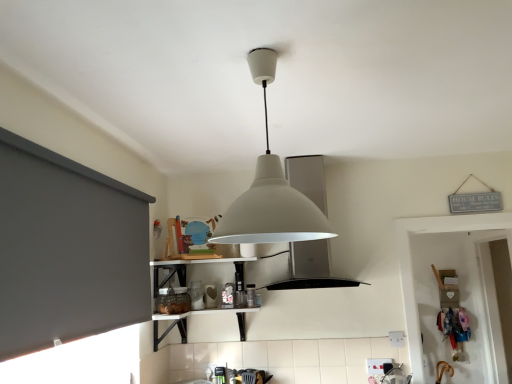
Where is `white matte vent at center`? The height and width of the screenshot is (384, 512). white matte vent at center is located at coordinates (311, 268).

Is white matte vent at center in contact with dark gray matte window screen at left?

No, white matte vent at center is not beside dark gray matte window screen at left.

Who is taller, white matte vent at center or dark gray matte window screen at left?

Standing taller between the two is white matte vent at center.

From the image's perspective, which is below, white matte vent at center or dark gray matte window screen at left?

dark gray matte window screen at left appears lower in the image.

What's the angular difference between white matte vent at center and dark gray matte window screen at left's facing directions?

The facing directions of white matte vent at center and dark gray matte window screen at left are 90.5 degrees apart.

Is dark gray matte window screen at left positioned with its back to white matte vent at center?

dark gray matte window screen at left does not have its back to white matte vent at center.

Based on their sizes in the image, would you say dark gray matte window screen at left is bigger or smaller than white matte vent at center?

dark gray matte window screen at left is smaller than white matte vent at center.

Considering the positions of points (102, 184) and (278, 287), is point (102, 184) closer to camera compared to point (278, 287)?

Yes, it is.

Are dark gray matte window screen at left and white matte vent at center far apart?

dark gray matte window screen at left is far away from white matte vent at center.

From a real-world perspective, is white matte lampshade at center located beneath white matte vent at center?

No.

Considering the sizes of objects white matte lampshade at center and white matte vent at center in the image provided, who is smaller, white matte lampshade at center or white matte vent at center?

white matte lampshade at center is smaller.

Which is more to the left, white matte lampshade at center or white matte vent at center?

white matte lampshade at center is more to the left.

Does white matte lampshade at center lie behind white matte vent at center?

No, it is in front of white matte vent at center.

Is white matte lampshade at center facing away from dark gray matte window screen at left?

No.

Identify the location of lamp above the dark gray matte window screen at left (from a real-world perspective). The image size is (512, 384). (270, 190).

In the scene shown: From a real-world perspective, which is physically below, white matte lampshade at center or dark gray matte window screen at left?

In real-world perspective, dark gray matte window screen at left is lower.

Looking at this image, is white matte lampshade at center directly adjacent to dark gray matte window screen at left?

There is a gap between white matte lampshade at center and dark gray matte window screen at left.

Would you say white matte vent at center is inside or outside white matte lampshade at center?

white matte vent at center is spatially situated outside white matte lampshade at center.

Is white matte vent at center in front of or behind white matte lampshade at center in the image?

Clearly, white matte vent at center is behind white matte lampshade at center.

From a real-world perspective, is white matte vent at center over white matte lampshade at center?

Incorrect, from a real-world perspective, white matte vent at center is lower than white matte lampshade at center.

From a real-world perspective, which is physically below, dark gray matte window screen at left or white matte lampshade at center?

dark gray matte window screen at left, from a real-world perspective.

Which is correct: dark gray matte window screen at left is inside white matte lampshade at center, or outside of it?

dark gray matte window screen at left is not inside white matte lampshade at center, it's outside.

Is point (75, 162) positioned behind point (245, 230)?

Yes, it is behind point (245, 230).

Is dark gray matte window screen at left aimed at white matte lampshade at center?

Yes, dark gray matte window screen at left is facing white matte lampshade at center.

You are a GUI agent. You are given a task and a screenshot of the screen. Output one action in this format:
    pyautogui.click(x=<x>, y=<y>)
    Task: Click on the window screen that appears below the white matte vent at center (from a real-world perspective)
    
    Given the screenshot: What is the action you would take?
    pyautogui.click(x=67, y=250)

At what (x,y) coordinates should I click in order to perform the action: click on window screen on the left of white matte vent at center. Please return your answer as a coordinate pair (x, y). This screenshot has height=384, width=512. Looking at the image, I should click on (67, 250).

Considering their positions, is white matte lampshade at center positioned closer to white matte vent at center than dark gray matte window screen at left?

dark gray matte window screen at left is positioned closer to the anchor white matte vent at center.

Which object lies further to the anchor point dark gray matte window screen at left, white matte vent at center or white matte lampshade at center?

Among the two, white matte vent at center is located further to dark gray matte window screen at left.

Considering their positions, is dark gray matte window screen at left positioned further to white matte vent at center than white matte lampshade at center?

white matte lampshade at center.

When comparing their distances from white matte lampshade at center, does white matte vent at center or dark gray matte window screen at left seem closer?

dark gray matte window screen at left.

When comparing their distances from dark gray matte window screen at left, does white matte lampshade at center or white matte vent at center seem closer?

white matte lampshade at center lies closer to dark gray matte window screen at left than the other object.

Looking at the image, which one is located further to white matte lampshade at center, dark gray matte window screen at left or white matte vent at center?

white matte vent at center lies further to white matte lampshade at center than the other object.

I want to click on window screen positioned between white matte lampshade at center and white matte vent at center from near to far, so click(67, 250).